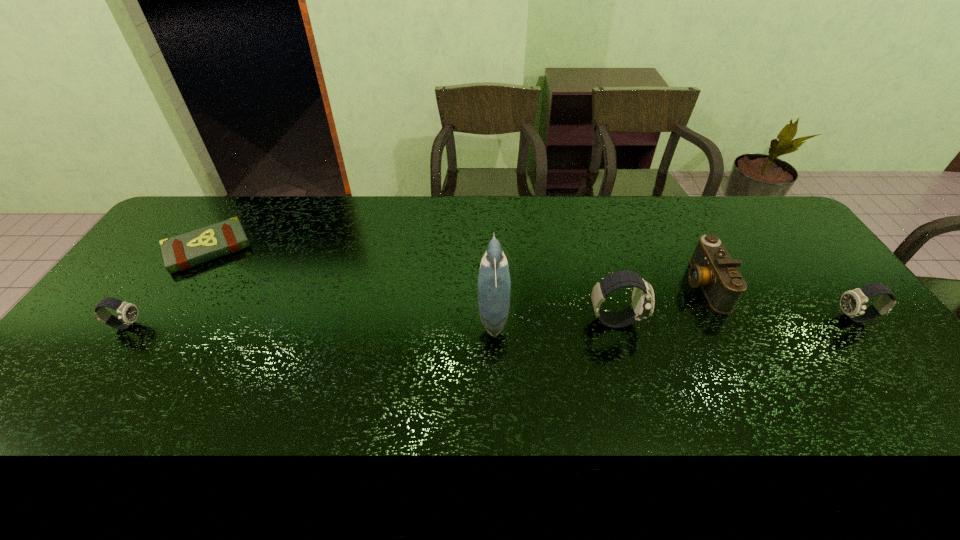
The height and width of the screenshot is (540, 960). Find the location of `the shortest watch`. the shortest watch is located at coordinates (127, 312).

Identify the location of the leftmost watch. (127, 312).

Locate an element on the screen. Image resolution: width=960 pixels, height=540 pixels. the second watch from right to left is located at coordinates (642, 306).

Identify the location of the third object from right to left. (642, 306).

The width and height of the screenshot is (960, 540). I want to click on the rightmost watch, so click(x=853, y=302).

Where is `the rightmost object`? the rightmost object is located at coordinates (853, 302).

Where is `the shortest object`? The image size is (960, 540). the shortest object is located at coordinates (181, 252).

Identify the location of camera. (711, 267).

I want to click on the tallest object, so click(494, 284).

Find the location of a particular element. This screenshot has height=540, width=960. bird is located at coordinates (494, 284).